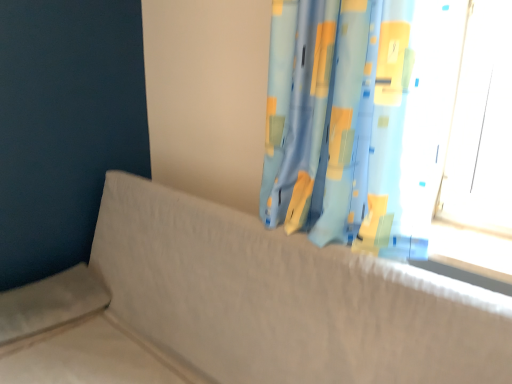
Question: Can you confirm if blue fabric curtain at upper right is thinner than textured beige couch at center?

Choices:
 (A) yes
 (B) no

Answer: (A)

Question: Can you confirm if blue fabric curtain at upper right is bigger than textured beige couch at center?

Choices:
 (A) yes
 (B) no

Answer: (B)

Question: Are blue fabric curtain at upper right and textured beige couch at center located far from each other?

Choices:
 (A) no
 (B) yes

Answer: (A)

Question: Is blue fabric curtain at upper right facing away from textured beige couch at center?

Choices:
 (A) yes
 (B) no

Answer: (B)

Question: Considering the relative sizes of blue fabric curtain at upper right and textured beige couch at center in the image provided, is blue fabric curtain at upper right shorter than textured beige couch at center?

Choices:
 (A) no
 (B) yes

Answer: (B)

Question: Considering the relative sizes of blue fabric curtain at upper right and textured beige couch at center in the image provided, is blue fabric curtain at upper right smaller than textured beige couch at center?

Choices:
 (A) yes
 (B) no

Answer: (A)

Question: Does textured beige couch at center lie behind blue fabric curtain at upper right?

Choices:
 (A) yes
 (B) no

Answer: (B)

Question: From the image's perspective, is textured beige couch at center above blue fabric curtain at upper right?

Choices:
 (A) no
 (B) yes

Answer: (A)

Question: Is textured beige couch at center oriented away from blue fabric curtain at upper right?

Choices:
 (A) yes
 (B) no

Answer: (B)

Question: From a real-world perspective, is textured beige couch at center under blue fabric curtain at upper right?

Choices:
 (A) yes
 (B) no

Answer: (A)

Question: Considering the relative sizes of textured beige couch at center and blue fabric curtain at upper right in the image provided, is textured beige couch at center thinner than blue fabric curtain at upper right?

Choices:
 (A) yes
 (B) no

Answer: (B)

Question: Is textured beige couch at center oriented towards blue fabric curtain at upper right?

Choices:
 (A) no
 (B) yes

Answer: (A)

Question: From a real-world perspective, is blue fabric curtain at upper right above or below textured beige couch at center?

Choices:
 (A) below
 (B) above

Answer: (B)